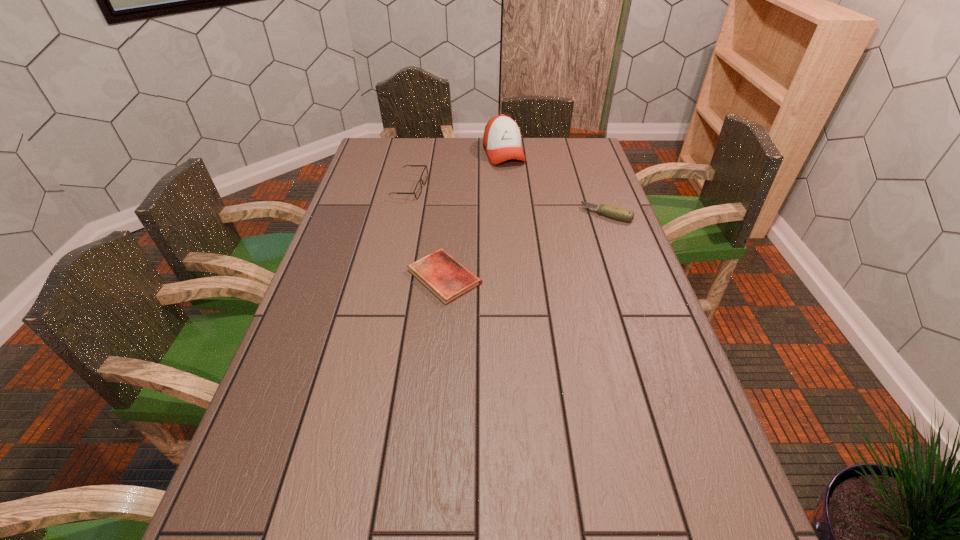
Identify the location of vacant area at the left edge of the desktop. This screenshot has height=540, width=960. (391, 184).

The width and height of the screenshot is (960, 540). I want to click on free space at the right edge, so click(564, 188).

In the image, there is a desktop. Where is `vacant space at the far left corner`? The width and height of the screenshot is (960, 540). vacant space at the far left corner is located at coordinates (399, 154).

Where is `vacant space at the far right corner of the desktop`? The height and width of the screenshot is (540, 960). vacant space at the far right corner of the desktop is located at coordinates (559, 161).

The image size is (960, 540). Find the location of `empty space that is in between the second object from right to left and the third shortest object`. empty space that is in between the second object from right to left and the third shortest object is located at coordinates (457, 171).

Find the location of a particular element. This screenshot has height=540, width=960. empty space between the second farthest object and the third farthest object is located at coordinates (508, 201).

In order to click on free area in between the nearest object and the third object from left to right in this screenshot , I will do `click(474, 215)`.

At what (x,y) coordinates should I click in order to perform the action: click on free point between the third tallest object and the diary. Please return your answer as a coordinate pair (x, y). Image resolution: width=960 pixels, height=540 pixels. Looking at the image, I should click on (526, 246).

Locate an element on the screen. This screenshot has width=960, height=540. vacant space that's between the tallest object and the spectacles is located at coordinates (457, 171).

This screenshot has width=960, height=540. Identify the location of empty location between the second farthest object and the nearest object. (427, 233).